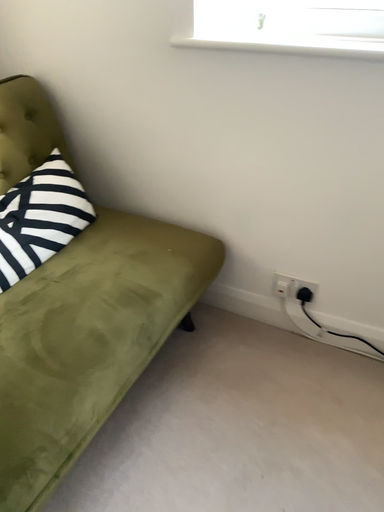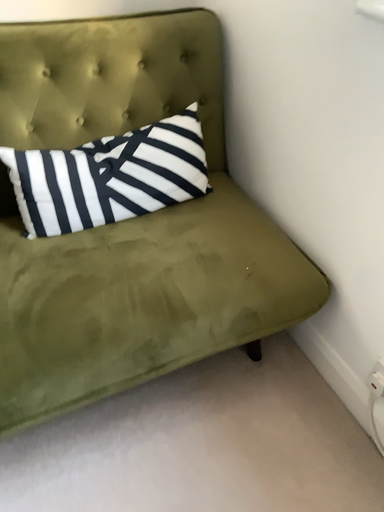
Question: Which way did the camera rotate in the video?

Choices:
 (A) rotated right
 (B) rotated left

Answer: (B)